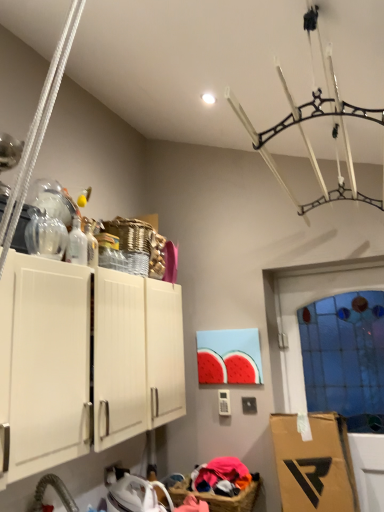
Question: From the image's perspective, is transparent glass bottle at upper left, the first bottle viewed from the front, on top of white matte cabinet at upper left?

Choices:
 (A) no
 (B) yes

Answer: (B)

Question: Are transparent glass bottle at upper left, placed as the 2th bottle when sorted from back to front, and white matte cabinet at upper left located far from each other?

Choices:
 (A) no
 (B) yes

Answer: (A)

Question: Considering the relative sizes of transparent glass bottle at upper left, placed as the 2th bottle when sorted from back to front, and white matte cabinet at upper left in the image provided, is transparent glass bottle at upper left, placed as the 2th bottle when sorted from back to front, thinner than white matte cabinet at upper left?

Choices:
 (A) no
 (B) yes

Answer: (B)

Question: Would you say transparent glass bottle at upper left, placed as the 2th bottle when sorted from back to front, contains white matte cabinet at upper left?

Choices:
 (A) yes
 (B) no

Answer: (B)

Question: Can you confirm if transparent glass bottle at upper left, the first bottle viewed from the front, is wider than white matte cabinet at upper left?

Choices:
 (A) no
 (B) yes

Answer: (A)

Question: Considering the relative positions of transparent glass bottle at upper left, the first bottle viewed from the front, and white matte cabinet at upper left in the image provided, is transparent glass bottle at upper left, the first bottle viewed from the front, behind white matte cabinet at upper left?

Choices:
 (A) no
 (B) yes

Answer: (B)

Question: From a real-world perspective, is white matte cabinet at upper left on clear glass bottle at upper left, the 1th bottle positioned from the back?

Choices:
 (A) yes
 (B) no

Answer: (B)

Question: Does white matte cabinet at upper left lie in front of clear glass bottle at upper left, the 1th bottle positioned from the back?

Choices:
 (A) yes
 (B) no

Answer: (A)

Question: Does white matte cabinet at upper left have a greater height compared to clear glass bottle at upper left, the 1th bottle positioned from the back?

Choices:
 (A) no
 (B) yes

Answer: (B)

Question: Is white matte cabinet at upper left not within clear glass bottle at upper left, placed as the 2th bottle when sorted from front to back?

Choices:
 (A) yes
 (B) no

Answer: (A)

Question: Does white matte cabinet at upper left have a larger size compared to clear glass bottle at upper left, placed as the 2th bottle when sorted from front to back?

Choices:
 (A) yes
 (B) no

Answer: (A)

Question: Is white matte cabinet at upper left turned away from clear glass bottle at upper left, placed as the 2th bottle when sorted from front to back?

Choices:
 (A) no
 (B) yes

Answer: (A)

Question: From the image's perspective, is transparent glass door at right on top of transparent glass bottle at upper left, placed as the 2th bottle when sorted from back to front?

Choices:
 (A) yes
 (B) no

Answer: (B)